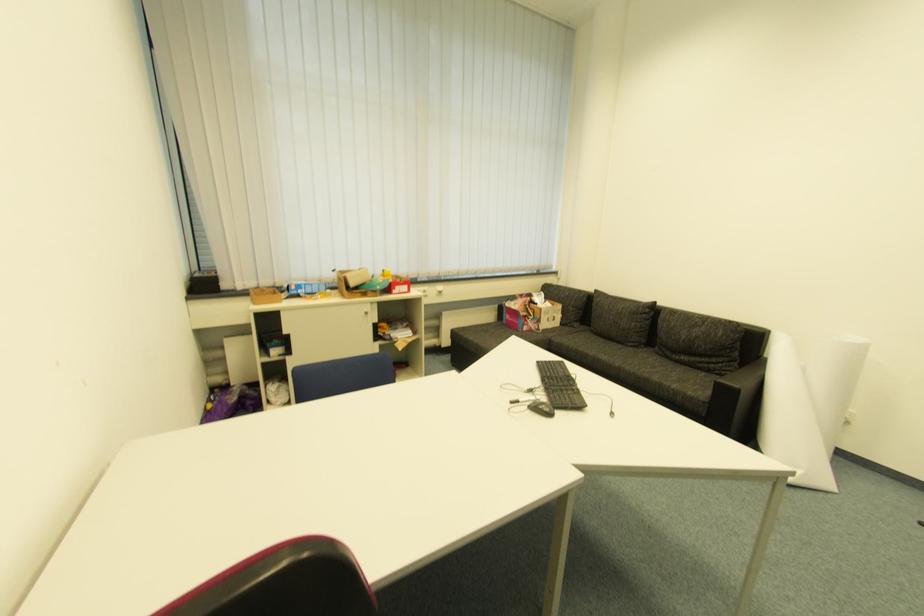
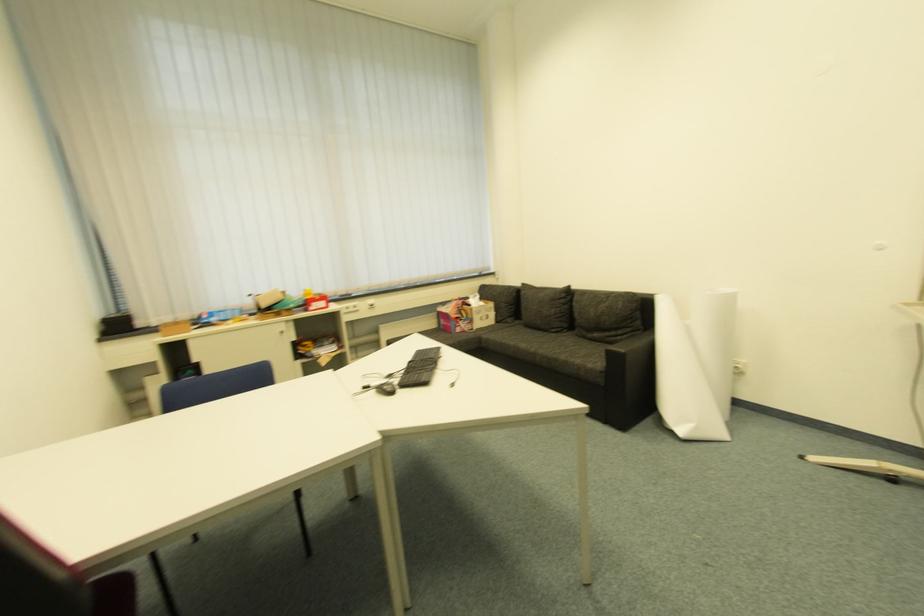
Question: The images are taken continuously from a first-person perspective. In which direction are you moving?

Choices:
 (A) Left
 (B) Right
 (C) Forward
 (D) Backward

Answer: (B)